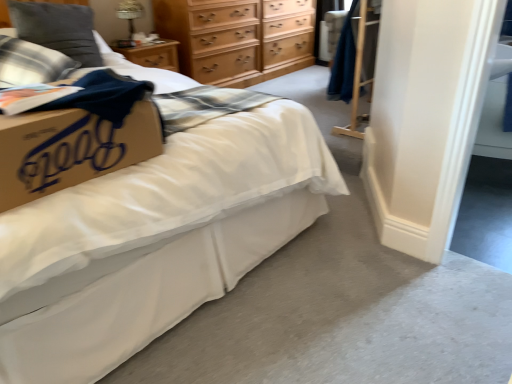
Question: Should I look upward or downward to see plaid fabric pillow at upper left, which appears as the first pillow when ordered from the bottom?

Choices:
 (A) down
 (B) up

Answer: (B)

Question: From a real-world perspective, is plaid fabric pillow at upper left, acting as the second pillow starting from the top, positioned over white matte bed at center based on gravity?

Choices:
 (A) yes
 (B) no

Answer: (A)

Question: Does plaid fabric pillow at upper left, acting as the second pillow starting from the top, turn towards white matte bed at center?

Choices:
 (A) no
 (B) yes

Answer: (B)

Question: Is plaid fabric pillow at upper left, which appears as the first pillow when ordered from the bottom, at the left side of white matte bed at center?

Choices:
 (A) no
 (B) yes

Answer: (B)

Question: Considering the relative positions of plaid fabric pillow at upper left, acting as the second pillow starting from the top, and white matte bed at center in the image provided, is plaid fabric pillow at upper left, acting as the second pillow starting from the top, to the right of white matte bed at center from the viewer's perspective?

Choices:
 (A) yes
 (B) no

Answer: (B)

Question: Can you confirm if plaid fabric pillow at upper left, acting as the second pillow starting from the top, is wider than white matte bed at center?

Choices:
 (A) yes
 (B) no

Answer: (B)

Question: From a real-world perspective, does plaid fabric pillow at upper left, which appears as the first pillow when ordered from the bottom, sit lower than white matte bed at center?

Choices:
 (A) yes
 (B) no

Answer: (B)

Question: Is white matte bed at center surrounded by plush gray pillow at upper left, which is the 2th pillow in bottom-to-top order?

Choices:
 (A) yes
 (B) no

Answer: (B)

Question: Can you confirm if plush gray pillow at upper left, which ranks as the 1th pillow in top-to-bottom order, is shorter than white matte bed at center?

Choices:
 (A) no
 (B) yes

Answer: (B)

Question: From a real-world perspective, is plush gray pillow at upper left, which is the 2th pillow in bottom-to-top order, beneath white matte bed at center?

Choices:
 (A) yes
 (B) no

Answer: (B)

Question: Can you see plush gray pillow at upper left, which is the 2th pillow in bottom-to-top order, touching white matte bed at center?

Choices:
 (A) yes
 (B) no

Answer: (B)

Question: Considering the relative sizes of plush gray pillow at upper left, which ranks as the 1th pillow in top-to-bottom order, and white matte bed at center in the image provided, is plush gray pillow at upper left, which ranks as the 1th pillow in top-to-bottom order, taller than white matte bed at center?

Choices:
 (A) no
 (B) yes

Answer: (A)

Question: Considering the relative sizes of plaid fabric pillow at upper left, which appears as the first pillow when ordered from the bottom, and light brown wooden chest of drawers at upper center in the image provided, is plaid fabric pillow at upper left, which appears as the first pillow when ordered from the bottom, smaller than light brown wooden chest of drawers at upper center?

Choices:
 (A) yes
 (B) no

Answer: (A)